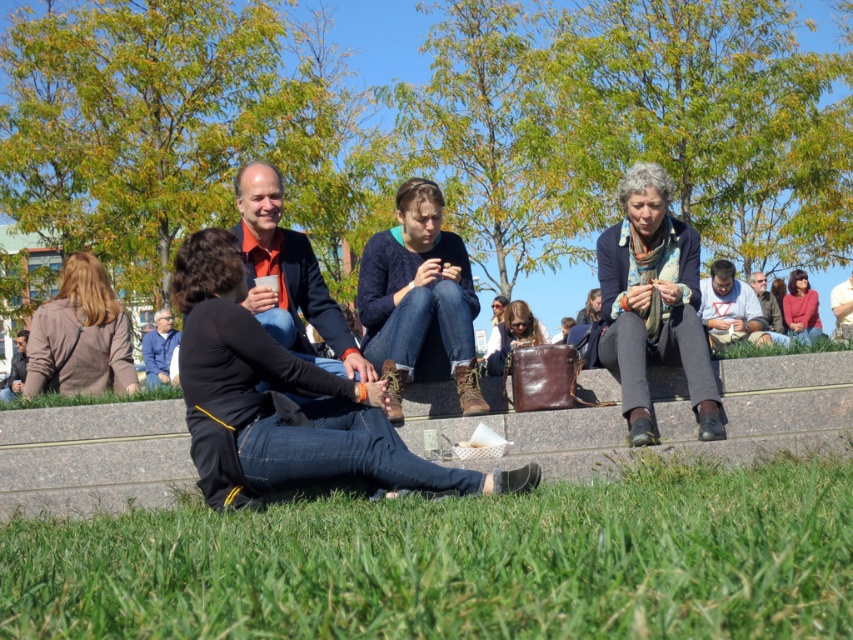
In the scene shown: You are a fashion designer observing the image and want to recommend a size for a new denim collection. Based on the comparison between the blue denim jeans at center and the blue denim jacket at lower left, which item would require more fabric in its design?

The blue denim jeans at center would require more fabric in its design since it has a larger size compared to the blue denim jacket at lower left.

You are standing at the position of the matte brown sweater at lower left and want to hand a small item to someone wearing the blue denim jeans at center. Can you directly hand it to them without walking towards them?

The blue denim jeans at center is 5.06 meters away from the matte brown sweater at lower left. Since 5.06 meters is a considerable distance, you would need to walk closer to hand the item directly.